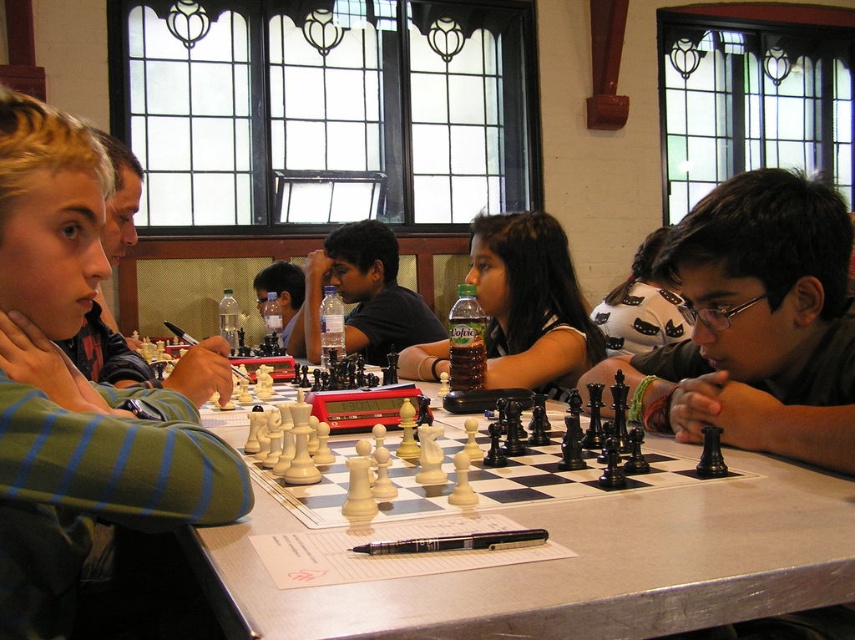
Please provide the coordinates of the black glossy chess pieces at center in the image. The coordinates should be in the format of a point with two decimal places, like 0.506, 0.884.

The coordinates of the black glossy chess pieces at center are at point (755,323).